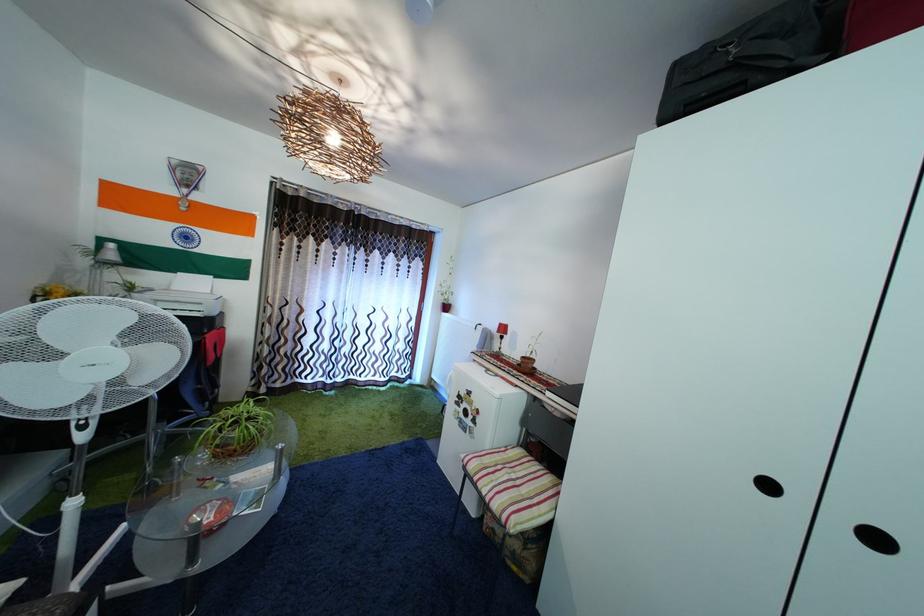
Where is `terracotta potted plant`? The image size is (924, 616). terracotta potted plant is located at coordinates (383, 384).